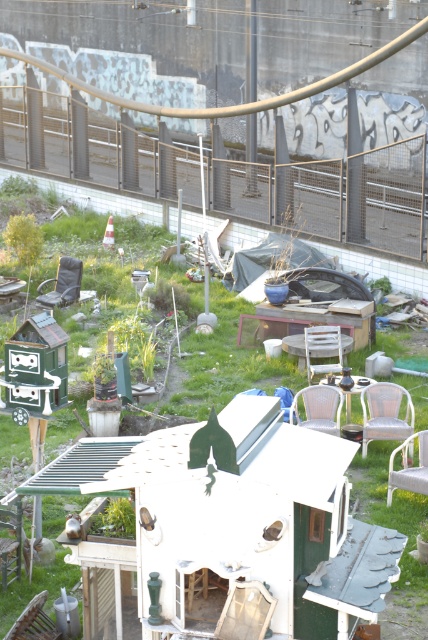
Question: Which object appears farthest from the camera in this image?

Choices:
 (A) matte black chair at center
 (B) rattan chair at center

Answer: (A)

Question: Which object appears closest to the camera in this image?

Choices:
 (A) rattan chair at center
 (B) white plastic chair at lower right

Answer: (B)

Question: Can you confirm if white plastic chair at lower right is smaller than white plastic chair at center?

Choices:
 (A) yes
 (B) no

Answer: (B)

Question: Does rattan chair at center appear over white plastic chair at center?

Choices:
 (A) yes
 (B) no

Answer: (B)

Question: Estimate the real-world distances between objects in this image. Which object is closer to the metallic mesh chair at center-right?

Choices:
 (A) white plastic chair at lower right
 (B) white plastic chair at center
 (C) matte black chair at center
 (D) rattan chair at center

Answer: (D)

Question: Does metallic mesh chair at center-right appear on the left side of white plastic chair at center?

Choices:
 (A) yes
 (B) no

Answer: (B)